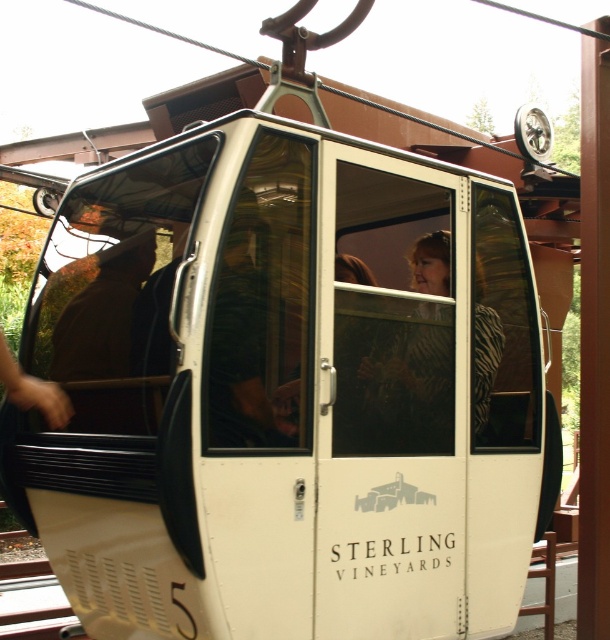
Is transparent glass window at center shorter than brown woolen hat at center?

No, transparent glass window at center is not shorter than brown woolen hat at center.

Between point (425, 364) and point (123, 300), which one is positioned in front?

Point (123, 300) is in front.

Is point (420, 403) in front of point (76, 305)?

That is True.

Where is `transparent glass window at center`? transparent glass window at center is located at coordinates (392, 376).

Can you confirm if transparent glass window at center is positioned to the left of transparent glass door at center?

In fact, transparent glass window at center is to the right of transparent glass door at center.

Can you confirm if transparent glass window at center is smaller than transparent glass door at center?

Incorrect, transparent glass window at center is not smaller in size than transparent glass door at center.

Is point (431, 449) positioned in front of point (267, 244)?

No.

Where is `transparent glass window at center`? transparent glass window at center is located at coordinates (392, 376).

Is transparent glass door at center to the left of brown woolen hat at center from the viewer's perspective?

Incorrect, transparent glass door at center is not on the left side of brown woolen hat at center.

Does point (306, 435) come in front of point (110, 280)?

Yes, it is in front of point (110, 280).

Is point (254, 289) positioned behind point (92, 428)?

No, (254, 289) is closer to viewer.

The image size is (610, 640). Find the location of `transparent glass door at center`. transparent glass door at center is located at coordinates (264, 305).